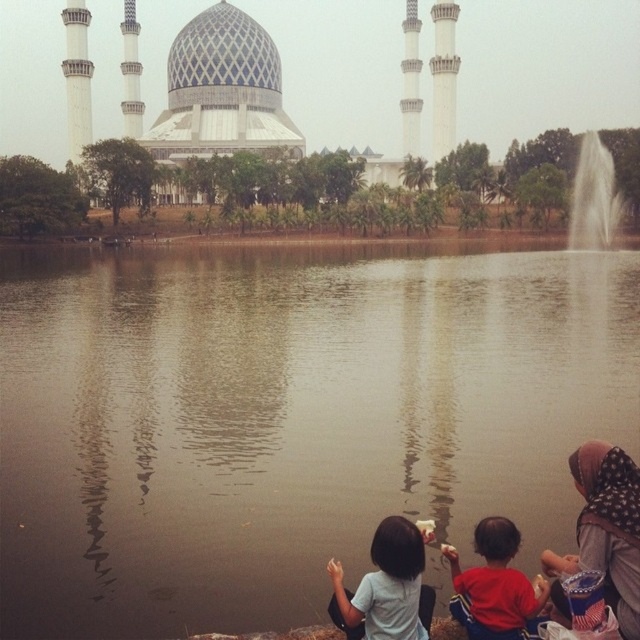
You are a photographer standing in the park and want to capture both the patterned fabric headscarf at lower right and the light blue fabric shirt at lower center in a single shot. Which object should you focus on first to ensure both are in frame?

You should focus on the patterned fabric headscarf at lower right first because it is taller than the light blue fabric shirt at lower center, so adjusting the camera angle to include its height will naturally include the shorter shirt in the frame as well.